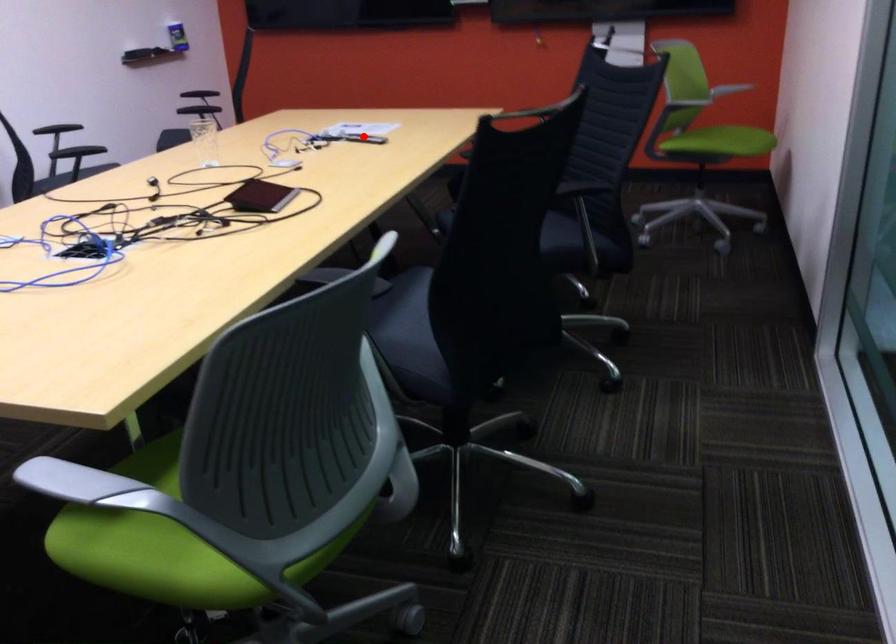
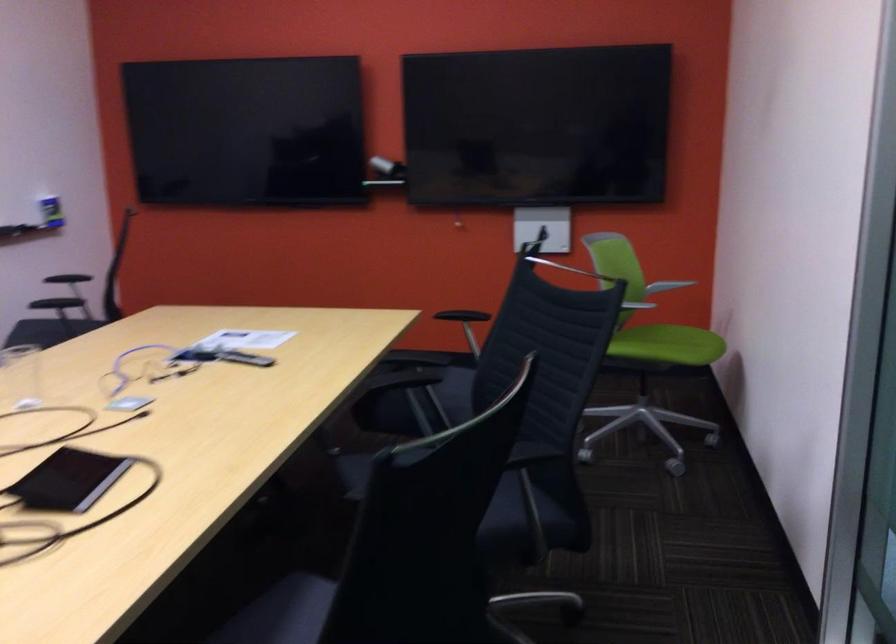
Question: I am providing you with two images of the same scene from different viewpoints. Image1 has a red point marked. In image2, the corresponding 3D location appears at what relative position? Reply with the corresponding letter.

Choices:
 (A) Closer
 (B) Farther

Answer: (A)